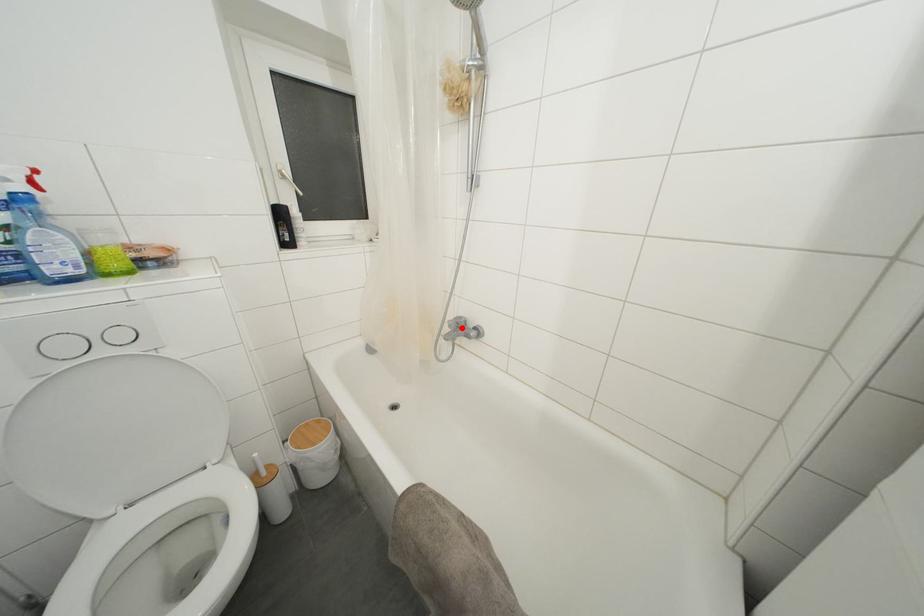
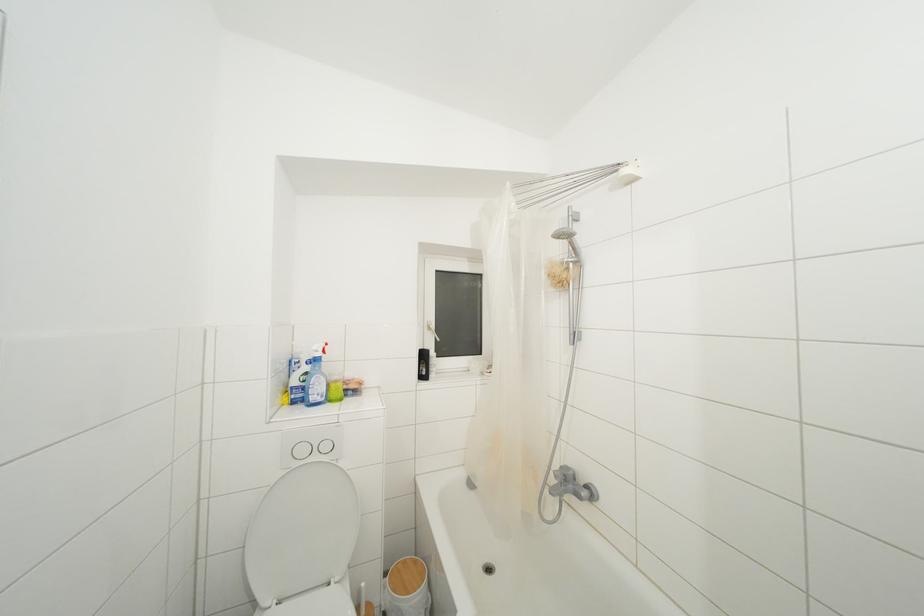
Where in the second image is the point corresponding to the highlighted location from the first image?

(568, 480)